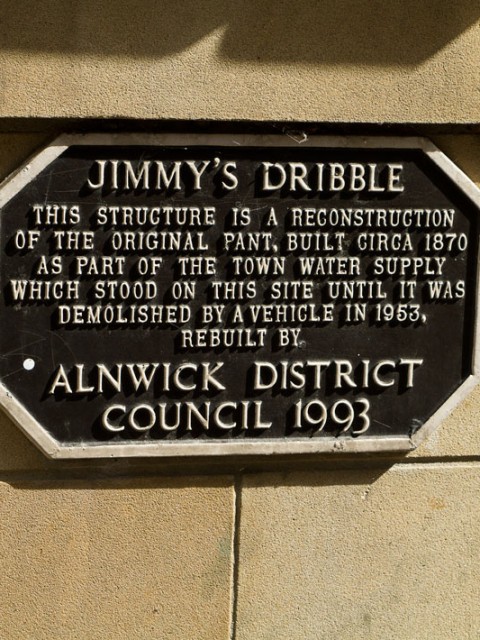
What are the coordinates of `shadows on top of wall` in the screenshot? It's located at (296, 29), (123, 16).